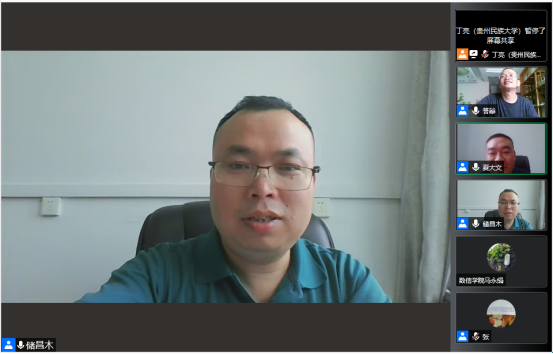
Find the location of a particular element. Image resolution: width=553 pixels, height=354 pixels. chair is located at coordinates (168, 225).